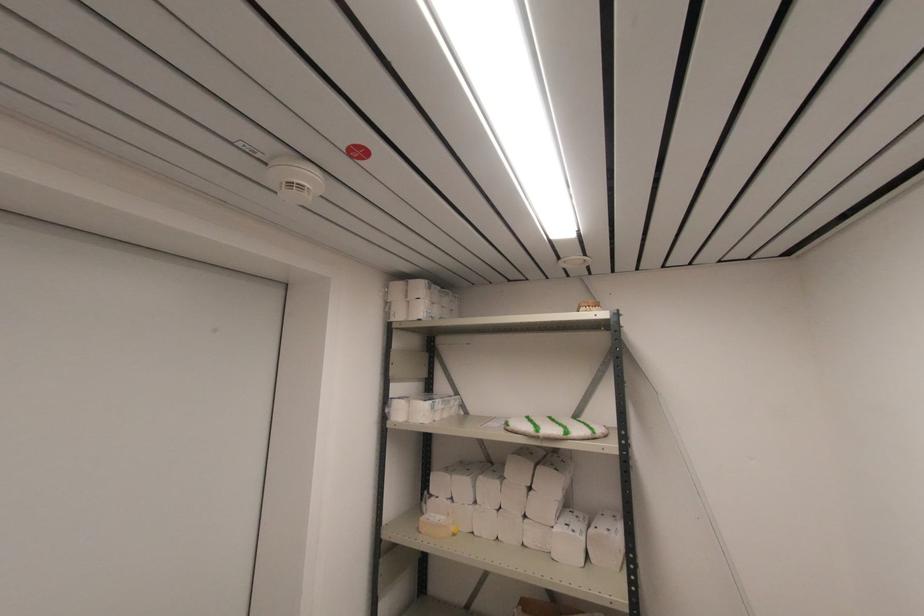
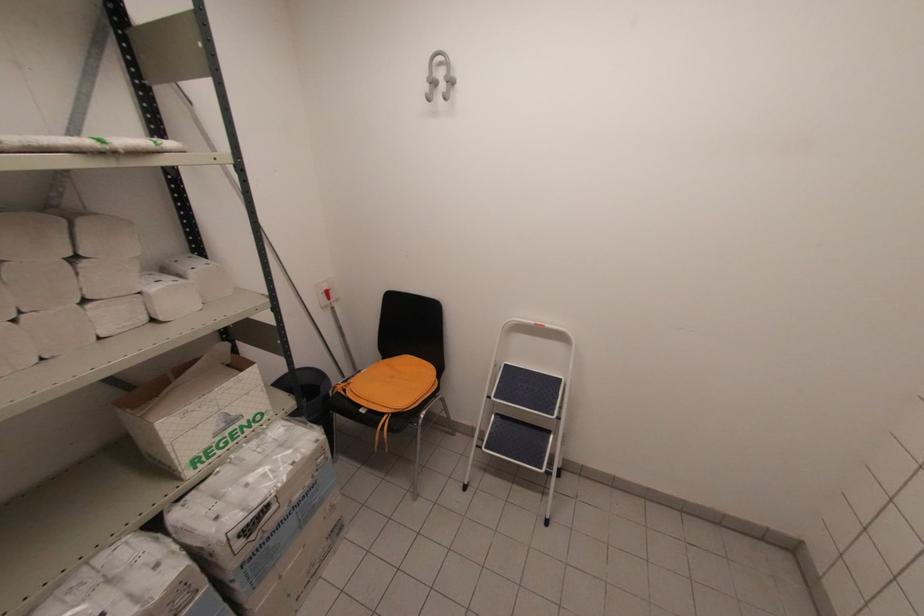
In the scene shown: First-person continuous shooting, in which direction is the camera rotating?

The camera's rotation is toward right-down.